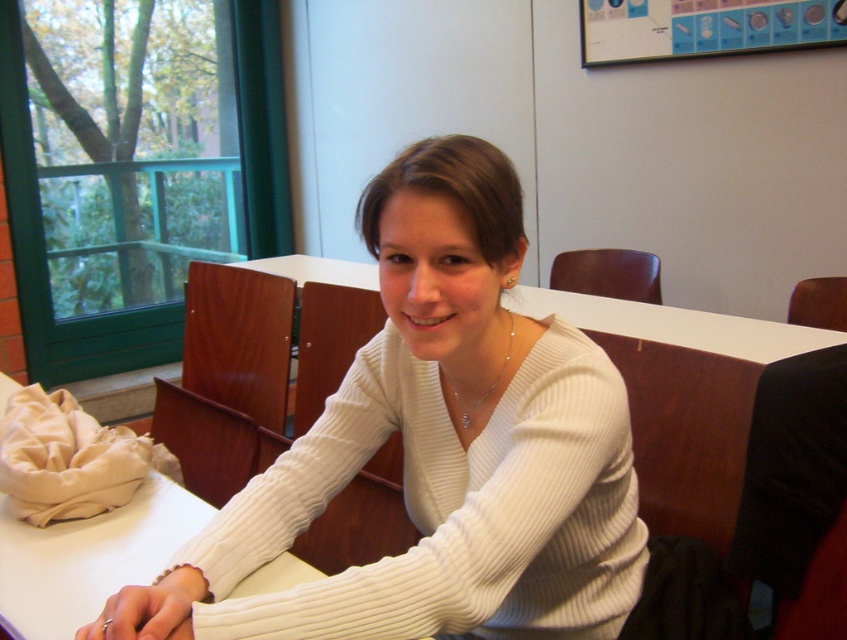
You are a photographer trying to capture the white ribbed sweater at center and the white ribbed sweater at upper center. Which sweater is layered on top?

The white ribbed sweater at center is layered on top of the white ribbed sweater at upper center because it is positioned over it.

Based on the photo, you are a photographer trying to capture the perfect shot of the white ribbed sweater at center and the white ribbed sweater at upper center. Which sweater should you focus on first if you want to ensure both are in frame without moving the camera?

You should focus on the white ribbed sweater at upper center first because it is shorter than the white ribbed sweater at center, allowing you to frame both within the camera view more easily.